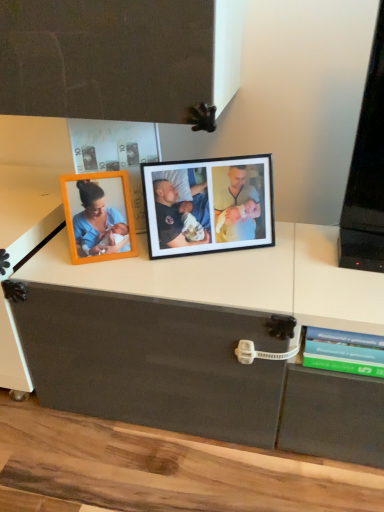
Question: Would you say black matte photo frame at center is a long distance from green matte book at lower right?

Choices:
 (A) yes
 (B) no

Answer: (B)

Question: Is black matte photo frame at center to the left of green matte book at lower right from the viewer's perspective?

Choices:
 (A) no
 (B) yes

Answer: (B)

Question: From the image's perspective, is black matte photo frame at center above green matte book at lower right?

Choices:
 (A) yes
 (B) no

Answer: (A)

Question: Is black matte photo frame at center aimed at green matte book at lower right?

Choices:
 (A) no
 (B) yes

Answer: (B)

Question: Is black matte photo frame at center located outside green matte book at lower right?

Choices:
 (A) yes
 (B) no

Answer: (A)

Question: Is black matte photo frame at center closer to the viewer compared to green matte book at lower right?

Choices:
 (A) no
 (B) yes

Answer: (A)

Question: Would you consider green matte book at lower right to be distant from black matte photo frame at center?

Choices:
 (A) yes
 (B) no

Answer: (B)

Question: Are green matte book at lower right and black matte photo frame at center beside each other?

Choices:
 (A) yes
 (B) no

Answer: (B)

Question: From a real-world perspective, is green matte book at lower right under black matte photo frame at center?

Choices:
 (A) yes
 (B) no

Answer: (A)

Question: Is green matte book at lower right positioned with its back to black matte photo frame at center?

Choices:
 (A) no
 (B) yes

Answer: (A)

Question: Does green matte book at lower right have a greater width compared to black matte photo frame at center?

Choices:
 (A) yes
 (B) no

Answer: (A)

Question: From the image's perspective, would you say green matte book at lower right is shown under black matte photo frame at center?

Choices:
 (A) no
 (B) yes

Answer: (B)

Question: Considering the relative positions of green matte book at lower right and black matte photo frame at center in the image provided, is green matte book at lower right to the left or to the right of black matte photo frame at center?

Choices:
 (A) left
 (B) right

Answer: (B)